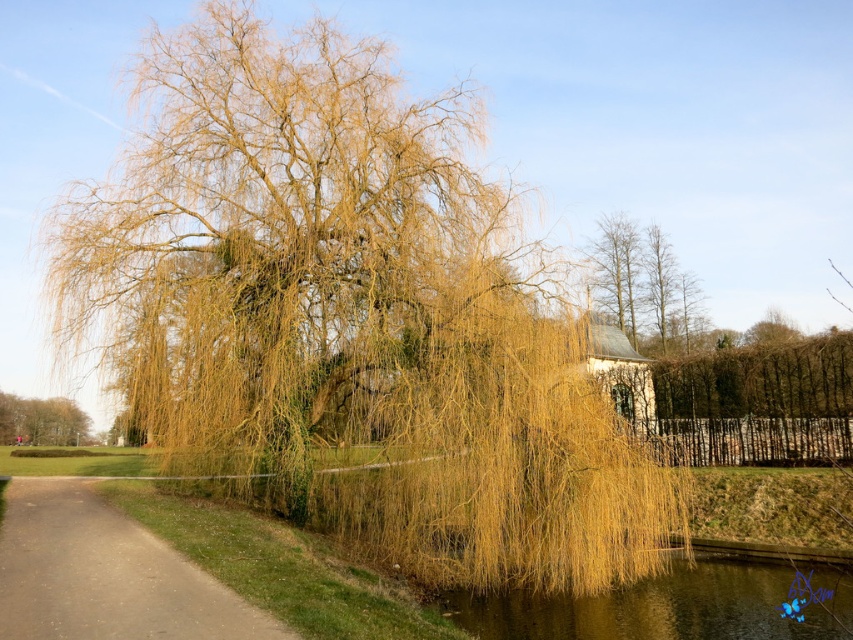
Question: Which is farther from the yellow-green textured willow at center?

Choices:
 (A) shiny dark water at lower center
 (B) golden textured willow at lower left
 (C) brown dirt path at lower left

Answer: (B)

Question: Can you confirm if yellow-green textured willow at center is smaller than golden textured willow at lower left?

Choices:
 (A) no
 (B) yes

Answer: (A)

Question: Considering the relative positions of shiny dark water at lower center and golden textured willow at lower left in the image provided, where is shiny dark water at lower center located with respect to golden textured willow at lower left?

Choices:
 (A) left
 (B) right

Answer: (B)

Question: Among these objects, which one is nearest to the camera?

Choices:
 (A) golden textured willow at lower left
 (B) shiny dark water at lower center

Answer: (B)

Question: Estimate the real-world distances between objects in this image. Which object is farther from the shiny dark water at lower center?

Choices:
 (A) golden textured willow at lower left
 (B) yellow-green textured willow at center
 (C) brown dirt path at lower left

Answer: (A)

Question: Is brown dirt path at lower left wider than shiny dark water at lower center?

Choices:
 (A) yes
 (B) no

Answer: (A)